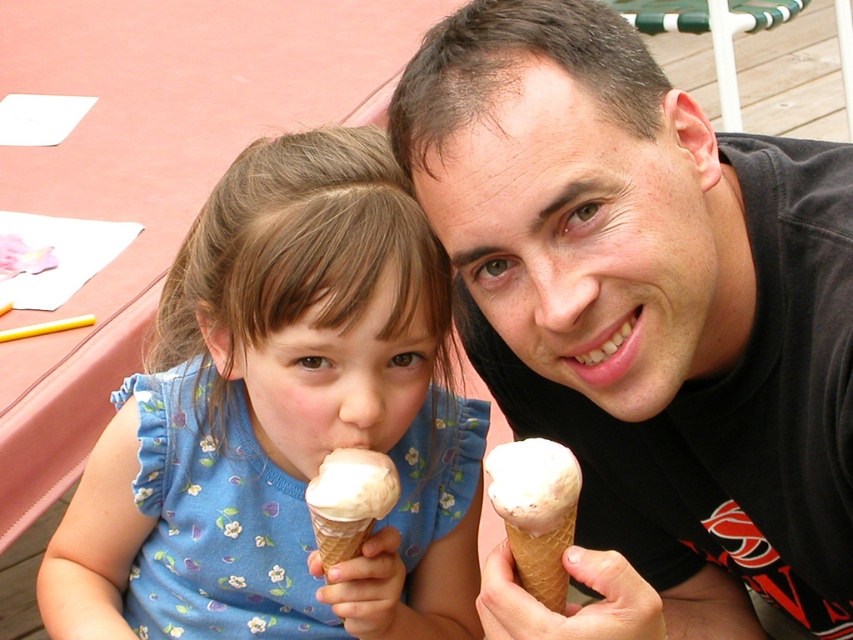
Can you confirm if blue floral dress at center is smaller than vanilla ice cream in waffle cone at right?

No, blue floral dress at center is not smaller than vanilla ice cream in waffle cone at right.

Is blue floral dress at center thinner than vanilla ice cream in waffle cone at right?

Incorrect, blue floral dress at center's width is not less than vanilla ice cream in waffle cone at right's.

The image size is (853, 640). I want to click on blue floral dress at center, so click(282, 420).

From the picture: Can you confirm if matte black ice cream cone at center is positioned to the right of blue floral dress at center?

Correct, you'll find matte black ice cream cone at center to the right of blue floral dress at center.

Is matte black ice cream cone at center to the left of blue floral dress at center from the viewer's perspective?

In fact, matte black ice cream cone at center is to the right of blue floral dress at center.

Where is `matte black ice cream cone at center`? The image size is (853, 640). matte black ice cream cone at center is located at coordinates (643, 317).

Who is positioned more to the left, vanilla ice cream in waffle cone at right or vanilla ice cream in waffle cone at lower center?

From the viewer's perspective, vanilla ice cream in waffle cone at lower center appears more on the left side.

Can you confirm if vanilla ice cream in waffle cone at right is shorter than vanilla ice cream in waffle cone at lower center?

No, vanilla ice cream in waffle cone at right is not shorter than vanilla ice cream in waffle cone at lower center.

Is point (531, 444) positioned after point (311, 515)?

No.

This screenshot has width=853, height=640. Identify the location of vanilla ice cream in waffle cone at right. (537, 512).